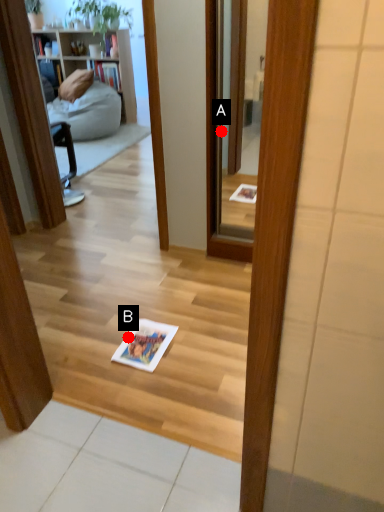
Question: Two points are circled on the image, labeled by A and B beside each circle. Which point is further to the camera?

Choices:
 (A) A is further
 (B) B is further

Answer: (A)